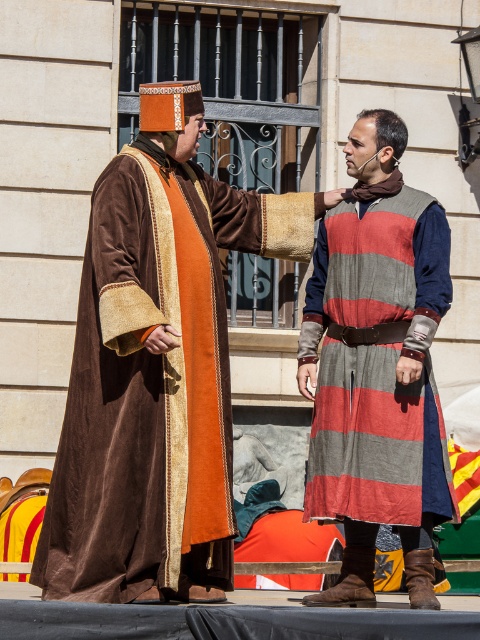
You are an archer positioned at the center of the scene. You have an arrow that can travel in a straight line. There is a target located at point (156, 369). Can you hit the velvet brown robe at left with your arrow without it passing through the striped tunic person on the right?

The point (156, 369) corresponds to the velvet brown robe at left, so yes, the arrow can hit the velvet brown robe at left directly without passing through the striped tunic person on the right.

Based on the scene description, which object is bigger between the velvet brown robe at left and the striped woolen tunic at center?

The velvet brown robe at left is larger in size compared to the striped woolen tunic at center.

You are an observer standing in front of the building with the barred window. You see the velvet brown robe at left and the striped woolen tunic at center. Which clothing item is positioned more to the left?

The velvet brown robe at left is positioned more to the left than the striped woolen tunic at center.